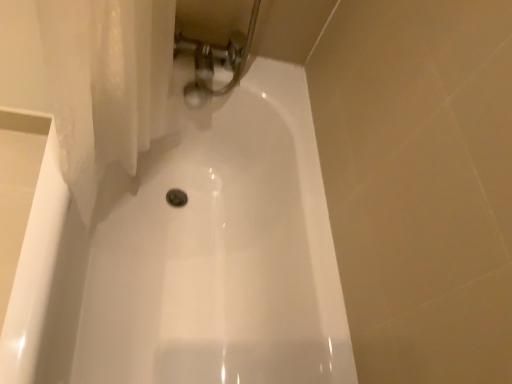
The image size is (512, 384). What do you see at coordinates (215, 60) in the screenshot?
I see `polished chrome faucet at upper center` at bounding box center [215, 60].

Find the location of a particular element. The image size is (512, 384). polished chrome faucet at upper center is located at coordinates (215, 60).

The width and height of the screenshot is (512, 384). What do you see at coordinates (189, 256) in the screenshot?
I see `white glossy bathtub at center` at bounding box center [189, 256].

You are a GUI agent. You are given a task and a screenshot of the screen. Output one action in this format:
    pyautogui.click(x=<x>, y=<y>)
    Task: Click on the white glossy bathtub at center
    
    Given the screenshot: What is the action you would take?
    pyautogui.click(x=189, y=256)

This screenshot has width=512, height=384. Identify the location of polished chrome faucet at upper center. (215, 60).

Looking at this image, which object is positioned more to the left, polished chrome faucet at upper center or white glossy bathtub at center?

From the viewer's perspective, white glossy bathtub at center appears more on the left side.

Which object is closer to the camera taking this photo, polished chrome faucet at upper center or white glossy bathtub at center?

Positioned in front is white glossy bathtub at center.

Which is behind, point (240, 66) or point (223, 361)?

The point (240, 66) is behind.

From the image's perspective, would you say polished chrome faucet at upper center is positioned over white glossy bathtub at center?

Indeed, from the image's perspective, polished chrome faucet at upper center is shown above white glossy bathtub at center.

From a real-world perspective, between polished chrome faucet at upper center and white glossy bathtub at center, who is vertically higher?

polished chrome faucet at upper center.

Which object is wider, polished chrome faucet at upper center or white glossy bathtub at center?

white glossy bathtub at center.

Which of these two, polished chrome faucet at upper center or white glossy bathtub at center, stands shorter?

polished chrome faucet at upper center.

Considering the sizes of polished chrome faucet at upper center and white glossy bathtub at center in the image, is polished chrome faucet at upper center bigger or smaller than white glossy bathtub at center?

In the image, polished chrome faucet at upper center appears to be smaller than white glossy bathtub at center.

Would you say polished chrome faucet at upper center contains white glossy bathtub at center?

No, white glossy bathtub at center is not inside polished chrome faucet at upper center.

Is polished chrome faucet at upper center far away from white glossy bathtub at center?

No, polished chrome faucet at upper center is in close proximity to white glossy bathtub at center.

Is polished chrome faucet at upper center turned away from white glossy bathtub at center?

No.

What's the angular difference between polished chrome faucet at upper center and white glossy bathtub at center's facing directions?

The facing directions of polished chrome faucet at upper center and white glossy bathtub at center are 90 degrees apart.

How distant is polished chrome faucet at upper center from white glossy bathtub at center?

polished chrome faucet at upper center and white glossy bathtub at center are 15.07 inches apart from each other.

Image resolution: width=512 pixels, height=384 pixels. Find the location of `bathtub on the left of polished chrome faucet at upper center`. bathtub on the left of polished chrome faucet at upper center is located at coordinates (189, 256).

Considering the positions of objects white glossy bathtub at center and polished chrome faucet at upper center in the image provided, who is more to the left, white glossy bathtub at center or polished chrome faucet at upper center?

white glossy bathtub at center.

Which object is closer to the camera, white glossy bathtub at center or polished chrome faucet at upper center?

white glossy bathtub at center is in front.

Which point is more forward, [259,314] or [194,107]?

Point [259,314]

From the image's perspective, is white glossy bathtub at center located above or below polished chrome faucet at upper center?

From the image's perspective, white glossy bathtub at center appears below polished chrome faucet at upper center.

From a real-world perspective, is white glossy bathtub at center over polished chrome faucet at upper center?

No, from a real-world perspective, white glossy bathtub at center is not on top of polished chrome faucet at upper center.

Considering the sizes of objects white glossy bathtub at center and polished chrome faucet at upper center in the image provided, who is wider, white glossy bathtub at center or polished chrome faucet at upper center?

With larger width is white glossy bathtub at center.

Between white glossy bathtub at center and polished chrome faucet at upper center, which one has less height?

polished chrome faucet at upper center is shorter.

Who is smaller, white glossy bathtub at center or polished chrome faucet at upper center?

With smaller size is polished chrome faucet at upper center.

Is polished chrome faucet at upper center inside white glossy bathtub at center?

Yes, polished chrome faucet at upper center is inside white glossy bathtub at center.

Are white glossy bathtub at center and polished chrome faucet at upper center far apart?

That's not correct — white glossy bathtub at center is a little close to polished chrome faucet at upper center.

Does white glossy bathtub at center turn towards polished chrome faucet at upper center?

No, white glossy bathtub at center is not oriented towards polished chrome faucet at upper center.

Locate an element on the screen. This screenshot has width=512, height=384. plumbing fixture above the white glossy bathtub at center (from the image's perspective) is located at coordinates (215, 60).

Find the location of a particular element. This screenshot has height=384, width=512. bathtub to the left of polished chrome faucet at upper center is located at coordinates (189, 256).

Find the location of a particular element. This screenshot has width=512, height=384. plumbing fixture behind the white glossy bathtub at center is located at coordinates (215, 60).